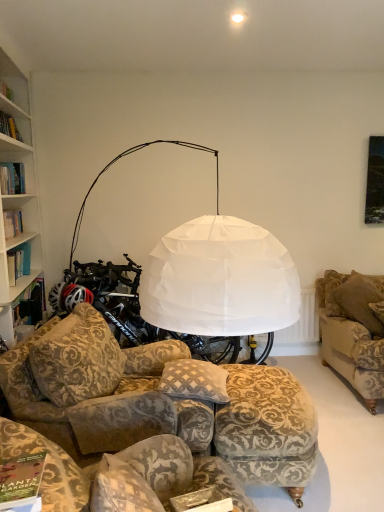
The height and width of the screenshot is (512, 384). What do you see at coordinates (237, 17) in the screenshot?
I see `white fabric lampshade at upper center` at bounding box center [237, 17].

What do you see at coordinates (267, 428) in the screenshot? I see `velvet floral ottoman at lower center` at bounding box center [267, 428].

At what (x,y) coordinates should I click in order to perform the action: click on patterned fabric pillow at center, the second pillow from the right. Please return your answer as a coordinate pair (x, y). This screenshot has width=384, height=512. Looking at the image, I should click on (194, 380).

You are a GUI agent. You are given a task and a screenshot of the screen. Output one action in this format:
    pyautogui.click(x=<x>, y=<y>)
    Task: Click on the white fabric lampshade at upper center
    This screenshot has height=512, width=384.
    Given the screenshot: What is the action you would take?
    pyautogui.click(x=237, y=17)

Which is in front, matte green book at lower left or velvet floral ottoman at lower center?

matte green book at lower left is closer to the camera.

Can you confirm if matte green book at lower left is smaller than velvet floral ottoman at lower center?

Correct, matte green book at lower left occupies less space than velvet floral ottoman at lower center.

Identify the location of magazine in front of the velvet floral ottoman at lower center. (21, 480).

Is matte green book at lower left positioned far away from velvet floral ottoman at lower center?

matte green book at lower left is positioned a significant distance from velvet floral ottoman at lower center.

What's the angular difference between white fabric lampshade at upper center and velvet floral-patterned couch at center, the 1th studio couch in the left-to-right sequence,'s facing directions?

115 degrees separate the facing orientations of white fabric lampshade at upper center and velvet floral-patterned couch at center, the 1th studio couch in the left-to-right sequence.

Is white fabric lampshade at upper center positioned far away from velvet floral-patterned couch at center, the 1th studio couch in the left-to-right sequence?

white fabric lampshade at upper center is far away from velvet floral-patterned couch at center, the 1th studio couch in the left-to-right sequence.

Find the location of a particular element. lighting that is on the right side of velvet floral-patterned couch at center, the 1th studio couch in the left-to-right sequence is located at coordinates (237, 17).

Would you say white fabric lampshade at upper center is to the left or to the right of velvet floral-patterned couch at center, the 1th studio couch in the left-to-right sequence, in the picture?

white fabric lampshade at upper center is to the right of velvet floral-patterned couch at center, the 1th studio couch in the left-to-right sequence.

Is patterned fabric pillow at center, the 2th pillow viewed from the back, positioned with its back to brown fabric pillow at right, the 1th pillow from the right?

No.

Who is smaller, patterned fabric pillow at center, the 2th pillow viewed from the back, or brown fabric pillow at right, which is the 2th pillow in front-to-back order?

patterned fabric pillow at center, the 2th pillow viewed from the back.

Is patterned fabric pillow at center, which is the 1th pillow in front-to-back order, spatially inside brown fabric pillow at right, marked as the first pillow in a back-to-front arrangement, or outside of it?

patterned fabric pillow at center, which is the 1th pillow in front-to-back order, cannot be found inside brown fabric pillow at right, marked as the first pillow in a back-to-front arrangement.

Is patterned fabric pillow at center, the second pillow from the right, to the left or to the right of brown fabric pillow at right, which is the 2th pillow in front-to-back order, in the image?

From the image, it's evident that patterned fabric pillow at center, the second pillow from the right, is to the left of brown fabric pillow at right, which is the 2th pillow in front-to-back order.

Is velvet-patterned couch at lower center, marked as the 2th studio couch in a left-to-right arrangement, facing away from white fabric lampshade at upper center?

No, white fabric lampshade at upper center is not at the back of velvet-patterned couch at lower center, marked as the 2th studio couch in a left-to-right arrangement.

Considering the points (304, 425) and (235, 15), which point is in front, point (304, 425) or point (235, 15)?

Point (304, 425)

Which of these two, velvet-patterned couch at lower center, the 1th studio couch positioned from the right, or white fabric lampshade at upper center, is wider?

With larger width is velvet-patterned couch at lower center, the 1th studio couch positioned from the right.

Find the location of a particular element. lighting behind the velvet floral-patterned couch at center, the 2th studio couch from the right is located at coordinates coord(237,17).

What's the angular difference between velvet floral-patterned couch at center, the 1th studio couch in the left-to-right sequence, and white fabric lampshade at upper center's facing directions?

The angular difference between velvet floral-patterned couch at center, the 1th studio couch in the left-to-right sequence, and white fabric lampshade at upper center is 115 degrees.

Is velvet floral-patterned couch at center, the 1th studio couch in the left-to-right sequence, not near white fabric lampshade at upper center?

velvet floral-patterned couch at center, the 1th studio couch in the left-to-right sequence, is positioned a significant distance from white fabric lampshade at upper center.

Considering the sizes of velvet floral-patterned couch at center, the 2th studio couch from the right, and white fabric lampshade at upper center in the image, is velvet floral-patterned couch at center, the 2th studio couch from the right, bigger or smaller than white fabric lampshade at upper center?

velvet floral-patterned couch at center, the 2th studio couch from the right, is bigger than white fabric lampshade at upper center.

You are a GUI agent. You are given a task and a screenshot of the screen. Output one action in this format:
    pyautogui.click(x=<x>, y=<y>)
    Task: Click on the magazine below the white fabric lampshade at upper center (from the image's perspective)
    
    Given the screenshot: What is the action you would take?
    pyautogui.click(x=21, y=480)

Which of these two, matte green book at lower left or white fabric lampshade at upper center, stands shorter?

With less height is white fabric lampshade at upper center.

Considering their positions, is velvet-patterned couch at lower center, marked as the 2th studio couch in a left-to-right arrangement, located in front of or behind velvet floral-patterned couch at center, the 1th studio couch in the left-to-right sequence?

Visually, velvet-patterned couch at lower center, marked as the 2th studio couch in a left-to-right arrangement, is located in front of velvet floral-patterned couch at center, the 1th studio couch in the left-to-right sequence.

In the image, there is a velvet floral-patterned couch at center, the 2th studio couch from the right. Where is `studio couch below it (from a real-world perspective)`? This screenshot has height=512, width=384. studio couch below it (from a real-world perspective) is located at coordinates (164, 404).

Is velvet-patterned couch at lower center, the 1th studio couch positioned from the right, to the left of velvet floral-patterned couch at center, the 2th studio couch from the right, from the viewer's perspective?

No, velvet-patterned couch at lower center, the 1th studio couch positioned from the right, is not to the left of velvet floral-patterned couch at center, the 2th studio couch from the right.

Considering the relative sizes of velvet-patterned couch at lower center, the 1th studio couch positioned from the right, and velvet floral-patterned couch at center, the 2th studio couch from the right, in the image provided, is velvet-patterned couch at lower center, the 1th studio couch positioned from the right, shorter than velvet floral-patterned couch at center, the 2th studio couch from the right,?

Incorrect, the height of velvet-patterned couch at lower center, the 1th studio couch positioned from the right, does not fall short of that of velvet floral-patterned couch at center, the 2th studio couch from the right.

Locate an element on the screen. The height and width of the screenshot is (512, 384). stool below the matte green book at lower left (from a real-world perspective) is located at coordinates (x=267, y=428).

This screenshot has width=384, height=512. In order to click on lighting positioned vertically above the velvet floral-patterned couch at center, the 2th studio couch from the right (from a real-world perspective) in this screenshot , I will do `click(237, 17)`.

From the image, which object appears to be nearer to white fabric lampshade at upper center, brown fabric pillow at right, marked as the first pillow in a back-to-front arrangement, or patterned fabric pillow at center, acting as the first pillow starting from the left?

brown fabric pillow at right, marked as the first pillow in a back-to-front arrangement, lies closer to white fabric lampshade at upper center than the other object.

Estimate the real-world distances between objects in this image. Which object is closer to patterned fabric pillow at center, the 2th pillow viewed from the back, white fabric lampshade at upper center or velvet-patterned couch at lower center, the 1th studio couch positioned from the right?

velvet-patterned couch at lower center, the 1th studio couch positioned from the right.

From the image, which object appears to be nearer to velvet floral-patterned couch at center, the 1th studio couch in the left-to-right sequence, velvet-patterned couch at lower center, marked as the 2th studio couch in a left-to-right arrangement, or patterned fabric pillow at center, the second pillow from the right?

Based on the image, patterned fabric pillow at center, the second pillow from the right, appears to be nearer to velvet floral-patterned couch at center, the 1th studio couch in the left-to-right sequence.

Estimate the real-world distances between objects in this image. Which object is further from velvet floral-patterned couch at center, the 1th studio couch in the left-to-right sequence, velvet-patterned couch at lower center, the 1th studio couch positioned from the right, or velvet floral ottoman at lower center?

Based on the image, velvet-patterned couch at lower center, the 1th studio couch positioned from the right, appears to be further to velvet floral-patterned couch at center, the 1th studio couch in the left-to-right sequence.

In the scene shown: Based on their spatial positions, is velvet floral ottoman at lower center or patterned fabric pillow at center, acting as the first pillow starting from the left, further from velvet floral-patterned couch at center, the 1th studio couch in the left-to-right sequence?

patterned fabric pillow at center, acting as the first pillow starting from the left, is further to velvet floral-patterned couch at center, the 1th studio couch in the left-to-right sequence.

Which object lies further to the anchor point velvet floral-patterned couch at center, the 2th studio couch from the right, brown fabric pillow at right, positioned as the 2th pillow in left-to-right order, or velvet floral ottoman at lower center?

Among the two, brown fabric pillow at right, positioned as the 2th pillow in left-to-right order, is located further to velvet floral-patterned couch at center, the 2th studio couch from the right.

Which object lies further to the anchor point brown fabric pillow at right, marked as the first pillow in a back-to-front arrangement, white fabric lampshade at upper center or patterned fabric pillow at center, the 2th pillow viewed from the back?

white fabric lampshade at upper center lies further to brown fabric pillow at right, marked as the first pillow in a back-to-front arrangement, than the other object.

When comparing their distances from velvet-patterned couch at lower center, marked as the 2th studio couch in a left-to-right arrangement, does white fabric lampshade at upper center or patterned fabric pillow at center, acting as the first pillow starting from the left, seem closer?

patterned fabric pillow at center, acting as the first pillow starting from the left, is positioned closer to the anchor velvet-patterned couch at lower center, marked as the 2th studio couch in a left-to-right arrangement.

I want to click on magazine between white fabric lampshade at upper center and velvet-patterned couch at lower center, the 1th studio couch positioned from the right, in the vertical direction, so click(x=21, y=480).

I want to click on stool between matte green book at lower left and patterned fabric pillow at center, the second pillow from the right, along the z-axis, so coord(267,428).

Find the location of a particular element. studio couch between velvet-patterned couch at lower center, marked as the 2th studio couch in a left-to-right arrangement, and brown fabric pillow at right, the 1th pillow from the right, from front to back is located at coordinates (221, 479).

This screenshot has height=512, width=384. Find the location of `magazine that lies between white fabric lampshade at upper center and patterned fabric pillow at center, the second pillow from the right, from top to bottom`. magazine that lies between white fabric lampshade at upper center and patterned fabric pillow at center, the second pillow from the right, from top to bottom is located at coordinates (21, 480).